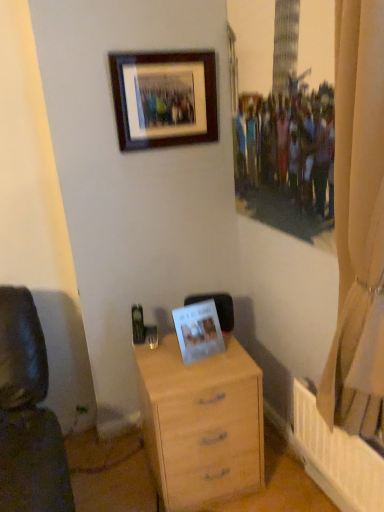
The height and width of the screenshot is (512, 384). I want to click on light wood chest of drawers at center, so click(x=201, y=423).

Image resolution: width=384 pixels, height=512 pixels. What do you see at coordinates (358, 224) in the screenshot?
I see `beige fabric curtain at right` at bounding box center [358, 224].

This screenshot has height=512, width=384. Describe the element at coordinates (198, 331) in the screenshot. I see `white paper photo frame at center, acting as the 1th picture frame starting from the bottom` at that location.

The width and height of the screenshot is (384, 512). I want to click on light wood chest of drawers at center, so click(201, 423).

Is wooden frame at upper center, the first picture frame when ordered from top to bottom, spatially inside beige fabric curtain at right, or outside of it?

wooden frame at upper center, the first picture frame when ordered from top to bottom, cannot be found inside beige fabric curtain at right.

What are the coordinates of `curtain below the wooden frame at upper center, arranged as the second picture frame when ordered from the bottom (from the image's perspective)` in the screenshot? It's located at (358, 224).

Are wooden frame at upper center, the first picture frame when ordered from top to bottom, and beige fabric curtain at right located far from each other?

No.

Do you think white paper photo frame at center, acting as the 1th picture frame starting from the bottom, is within light wood chest of drawers at center, or outside of it?

The correct answer is: outside.

From the image's perspective, would you say white paper photo frame at center, marked as the second picture frame in a top-to-bottom arrangement, is positioned over light wood chest of drawers at center?

Yes, from the image's perspective, white paper photo frame at center, marked as the second picture frame in a top-to-bottom arrangement, is above light wood chest of drawers at center.

Does point (207, 304) lie in front of point (154, 464)?

Yes, it is in front of point (154, 464).

Who is bigger, white paper photo frame at center, marked as the second picture frame in a top-to-bottom arrangement, or light wood chest of drawers at center?

Bigger between the two is light wood chest of drawers at center.

Are white paper photo frame at center, acting as the 1th picture frame starting from the bottom, and beige fabric curtain at right located far from each other?

white paper photo frame at center, acting as the 1th picture frame starting from the bottom, is near beige fabric curtain at right, not far away.

Consider the image. Looking at the image, does white paper photo frame at center, acting as the 1th picture frame starting from the bottom, seem bigger or smaller compared to beige fabric curtain at right?

Considering their sizes, white paper photo frame at center, acting as the 1th picture frame starting from the bottom, takes up less space than beige fabric curtain at right.

Which is in front, white paper photo frame at center, marked as the second picture frame in a top-to-bottom arrangement, or beige fabric curtain at right?

Positioned in front is beige fabric curtain at right.

From a real-world perspective, relative to beige fabric curtain at right, is white paper photo frame at center, marked as the second picture frame in a top-to-bottom arrangement, vertically above or below?

Clearly, from a real-world perspective, white paper photo frame at center, marked as the second picture frame in a top-to-bottom arrangement, is below beige fabric curtain at right.

Is wooden frame at upper center, arranged as the second picture frame when ordered from the bottom, surrounded by white paper photo frame at center, marked as the second picture frame in a top-to-bottom arrangement?

No, wooden frame at upper center, arranged as the second picture frame when ordered from the bottom, is not a part of white paper photo frame at center, marked as the second picture frame in a top-to-bottom arrangement.

Considering the relative positions of white paper photo frame at center, marked as the second picture frame in a top-to-bottom arrangement, and wooden frame at upper center, arranged as the second picture frame when ordered from the bottom, in the image provided, is white paper photo frame at center, marked as the second picture frame in a top-to-bottom arrangement, to the left or to the right of wooden frame at upper center, arranged as the second picture frame when ordered from the bottom,?

Based on their positions, white paper photo frame at center, marked as the second picture frame in a top-to-bottom arrangement, is located to the right of wooden frame at upper center, arranged as the second picture frame when ordered from the bottom.

Between point (185, 360) and point (156, 118), which one is positioned behind?

Point (156, 118)

From the image's perspective, between white paper photo frame at center, acting as the 1th picture frame starting from the bottom, and wooden frame at upper center, arranged as the second picture frame when ordered from the bottom, which one is located above?

wooden frame at upper center, arranged as the second picture frame when ordered from the bottom.

Measure the distance from wooden frame at upper center, arranged as the second picture frame when ordered from the bottom, to light wood chest of drawers at center.

wooden frame at upper center, arranged as the second picture frame when ordered from the bottom, is 3.44 feet away from light wood chest of drawers at center.

Which is more to the left, wooden frame at upper center, the first picture frame when ordered from top to bottom, or light wood chest of drawers at center?

wooden frame at upper center, the first picture frame when ordered from top to bottom.

In terms of size, does wooden frame at upper center, arranged as the second picture frame when ordered from the bottom, appear bigger or smaller than light wood chest of drawers at center?

Clearly, wooden frame at upper center, arranged as the second picture frame when ordered from the bottom, is smaller in size than light wood chest of drawers at center.

Is wooden frame at upper center, arranged as the second picture frame when ordered from the bottom, oriented towards light wood chest of drawers at center?

No.

Measure the distance from light wood chest of drawers at center to white paper photo frame at center, marked as the second picture frame in a top-to-bottom arrangement.

light wood chest of drawers at center and white paper photo frame at center, marked as the second picture frame in a top-to-bottom arrangement, are 8.58 inches apart.

Considering the points (179, 428) and (196, 334), which point is behind, point (179, 428) or point (196, 334)?

The point (196, 334) is behind.

Do you think light wood chest of drawers at center is within white paper photo frame at center, acting as the 1th picture frame starting from the bottom, or outside of it?

light wood chest of drawers at center exists outside the volume of white paper photo frame at center, acting as the 1th picture frame starting from the bottom.

Is light wood chest of drawers at center positioned far away from white paper photo frame at center, acting as the 1th picture frame starting from the bottom?

No, there isn't a large distance between light wood chest of drawers at center and white paper photo frame at center, acting as the 1th picture frame starting from the bottom.

From the image's perspective, is wooden frame at upper center, arranged as the second picture frame when ordered from the bottom, on white paper photo frame at center, marked as the second picture frame in a top-to-bottom arrangement?

Correct, wooden frame at upper center, arranged as the second picture frame when ordered from the bottom, appears higher than white paper photo frame at center, marked as the second picture frame in a top-to-bottom arrangement, in the image.

How many degrees apart are the facing directions of wooden frame at upper center, the first picture frame when ordered from top to bottom, and white paper photo frame at center, marked as the second picture frame in a top-to-bottom arrangement?

1.71 degrees.

Is point (133, 98) behind point (197, 311)?

Yes, it is behind point (197, 311).

Which object is positioned more to the right, wooden frame at upper center, the first picture frame when ordered from top to bottom, or white paper photo frame at center, marked as the second picture frame in a top-to-bottom arrangement?

white paper photo frame at center, marked as the second picture frame in a top-to-bottom arrangement, is more to the right.

I want to click on picture frame that is the 2nd one when counting leftward from the beige fabric curtain at right, so click(x=164, y=98).

At what (x,y) coordinates should I click in order to perform the action: click on chest of drawers below the white paper photo frame at center, acting as the 1th picture frame starting from the bottom (from a real-world perspective). Please return your answer as a coordinate pair (x, y). This screenshot has width=384, height=512. Looking at the image, I should click on (201, 423).

Estimate the real-world distances between objects in this image. Which object is closer to beige fabric curtain at right, wooden frame at upper center, arranged as the second picture frame when ordered from the bottom, or light wood chest of drawers at center?

Based on the image, light wood chest of drawers at center appears to be nearer to beige fabric curtain at right.

Looking at the image, which one is located further to white paper photo frame at center, acting as the 1th picture frame starting from the bottom, wooden frame at upper center, the first picture frame when ordered from top to bottom, or light wood chest of drawers at center?

wooden frame at upper center, the first picture frame when ordered from top to bottom, is positioned further to the anchor white paper photo frame at center, acting as the 1th picture frame starting from the bottom.

Which object lies nearer to the anchor point wooden frame at upper center, arranged as the second picture frame when ordered from the bottom, white paper photo frame at center, marked as the second picture frame in a top-to-bottom arrangement, or beige fabric curtain at right?

The object closer to wooden frame at upper center, arranged as the second picture frame when ordered from the bottom, is white paper photo frame at center, marked as the second picture frame in a top-to-bottom arrangement.

Which object lies nearer to the anchor point light wood chest of drawers at center, white paper photo frame at center, acting as the 1th picture frame starting from the bottom, or beige fabric curtain at right?

white paper photo frame at center, acting as the 1th picture frame starting from the bottom.

Looking at the image, which one is located closer to wooden frame at upper center, the first picture frame when ordered from top to bottom, beige fabric curtain at right or white paper photo frame at center, acting as the 1th picture frame starting from the bottom?

white paper photo frame at center, acting as the 1th picture frame starting from the bottom.

From the image, which object appears to be nearer to white paper photo frame at center, marked as the second picture frame in a top-to-bottom arrangement, light wood chest of drawers at center or wooden frame at upper center, arranged as the second picture frame when ordered from the bottom?

Among the two, light wood chest of drawers at center is located nearer to white paper photo frame at center, marked as the second picture frame in a top-to-bottom arrangement.

Estimate the real-world distances between objects in this image. Which object is further from wooden frame at upper center, the first picture frame when ordered from top to bottom, white paper photo frame at center, marked as the second picture frame in a top-to-bottom arrangement, or light wood chest of drawers at center?

Based on the image, light wood chest of drawers at center appears to be further to wooden frame at upper center, the first picture frame when ordered from top to bottom.

Looking at this image, considering their positions, is beige fabric curtain at right positioned closer to light wood chest of drawers at center than wooden frame at upper center, the first picture frame when ordered from top to bottom?

Among the two, beige fabric curtain at right is located nearer to light wood chest of drawers at center.

You are a GUI agent. You are given a task and a screenshot of the screen. Output one action in this format:
    pyautogui.click(x=<x>, y=<y>)
    Task: Click on the picture frame between wooden frame at upper center, the first picture frame when ordered from top to bottom, and light wood chest of drawers at center, in the vertical direction
    The height and width of the screenshot is (512, 384).
    Given the screenshot: What is the action you would take?
    pyautogui.click(x=198, y=331)

Locate an element on the screen. The height and width of the screenshot is (512, 384). curtain between wooden frame at upper center, the first picture frame when ordered from top to bottom, and light wood chest of drawers at center vertically is located at coordinates (358, 224).

Where is `curtain between wooden frame at upper center, the first picture frame when ordered from top to bottom, and white paper photo frame at center, acting as the 1th picture frame starting from the bottom, vertically`? curtain between wooden frame at upper center, the first picture frame when ordered from top to bottom, and white paper photo frame at center, acting as the 1th picture frame starting from the bottom, vertically is located at coordinates (358, 224).

Locate an element on the screen. The height and width of the screenshot is (512, 384). the chest of drawers located between beige fabric curtain at right and white paper photo frame at center, acting as the 1th picture frame starting from the bottom, in the depth direction is located at coordinates (201, 423).